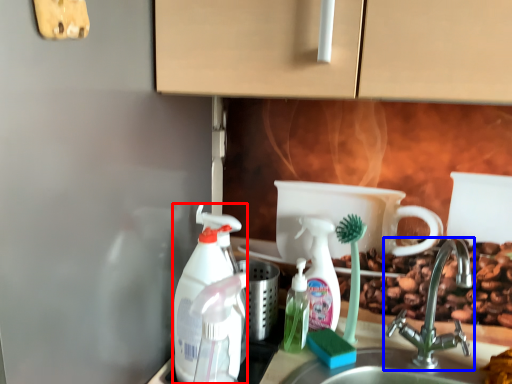
Question: Among these objects, which one is nearest to the camera, cleaning product (highlighted by a red box) or tap (highlighted by a blue box)?

Choices:
 (A) cleaning product
 (B) tap

Answer: (B)